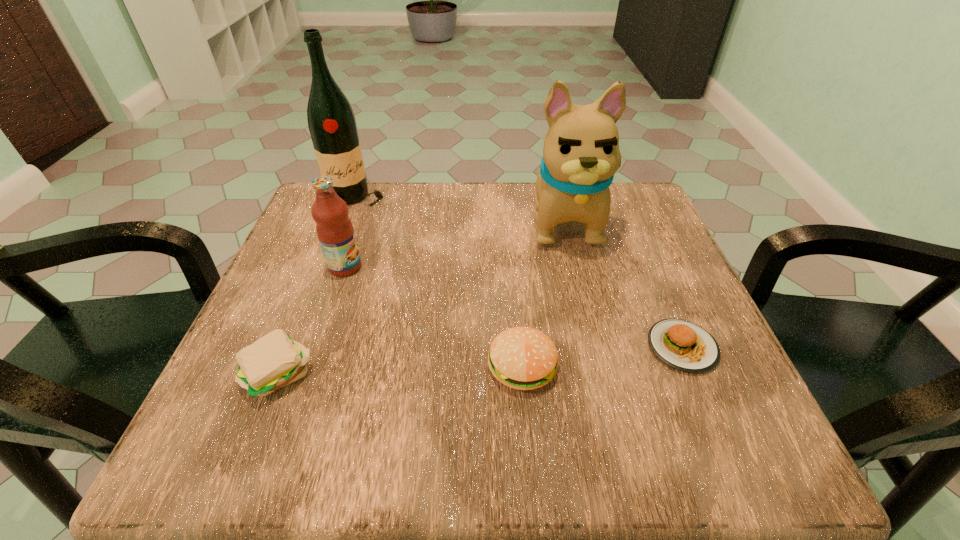
This screenshot has width=960, height=540. What are the coordinates of `blank space located 0.210m on the left of the second food from left to right` in the screenshot? It's located at (361, 367).

Find the location of a particular element. This screenshot has width=960, height=540. vacant space located on the right of the leftmost food is located at coordinates (405, 375).

Find the location of a particular element. The image size is (960, 540). vacant region located 0.110m on the front of the rightmost food is located at coordinates (721, 440).

The image size is (960, 540). Identify the location of wine bottle at the far edge. (331, 121).

Locate an element on the screen. The image size is (960, 540). puppy present at the far edge is located at coordinates (581, 154).

The width and height of the screenshot is (960, 540). What are the coordinates of `wine bottle at the left edge` in the screenshot? It's located at tap(331, 121).

Identify the location of fruit juice present at the left edge. The height and width of the screenshot is (540, 960). pyautogui.click(x=335, y=231).

This screenshot has height=540, width=960. In order to click on patty at the left edge in this screenshot , I will do `click(275, 360)`.

The image size is (960, 540). I want to click on puppy situated at the right edge, so click(581, 154).

Identify the location of food that is at the right edge. The width and height of the screenshot is (960, 540). (685, 346).